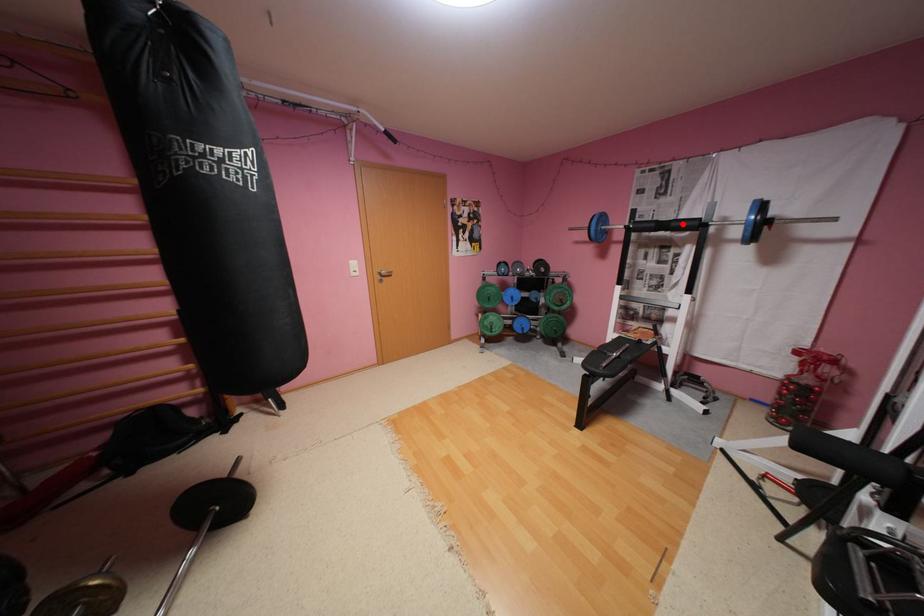
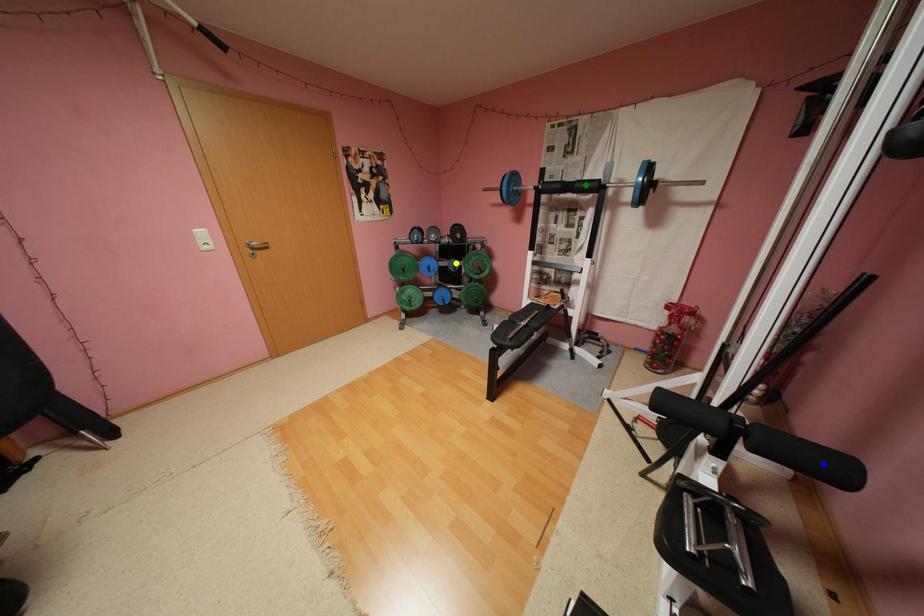
Question: I am providing you with two images of the same scene from different viewpoints. A red point is marked on the first image. You are given multiple points on the second image. In image 2, which mark is for the same physical point as the one in image 1?

Choices:
 (A) blue point
 (B) yellow point
 (C) green point

Answer: (C)